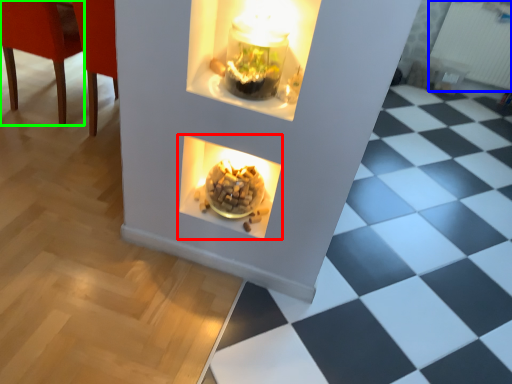
Question: Based on their relative distances, which object is nearer to fireplace (highlighted by a red box)? Choose from radiator (highlighted by a blue box) and chair (highlighted by a green box).

Choices:
 (A) radiator
 (B) chair

Answer: (B)